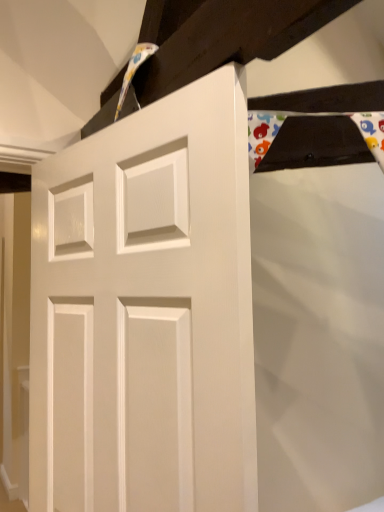
You are a GUI agent. You are given a task and a screenshot of the screen. Output one action in this format:
    pyautogui.click(x=<x>, y=<y>)
    Task: Click on the white glossy door at center
    Image resolution: width=384 pixels, height=512 pixels.
    Given the screenshot: What is the action you would take?
    click(x=152, y=306)

The image size is (384, 512). What do you see at coordinates (152, 306) in the screenshot? I see `white glossy door at center` at bounding box center [152, 306].

You are a GUI agent. You are given a task and a screenshot of the screen. Output one action in this format:
    pyautogui.click(x=<x>, y=<y>)
    Task: Click on the white glossy door at center
    The width and height of the screenshot is (384, 512).
    Given the screenshot: What is the action you would take?
    pyautogui.click(x=152, y=306)